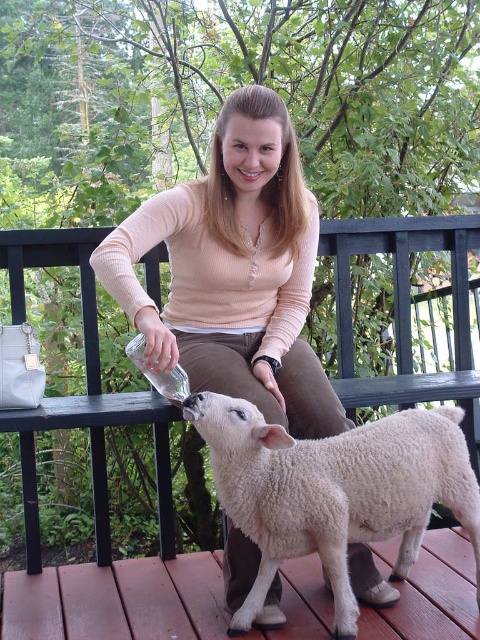
Between matte peach sweater at center and white woolen lamb at lower center, which one appears on the left side from the viewer's perspective?

Positioned to the left is matte peach sweater at center.

Is matte peach sweater at center closer to camera compared to white woolen lamb at lower center?

No, matte peach sweater at center is behind white woolen lamb at lower center.

This screenshot has width=480, height=640. Describe the element at coordinates (235, 272) in the screenshot. I see `matte peach sweater at center` at that location.

Identify the location of matte peach sweater at center. (235, 272).